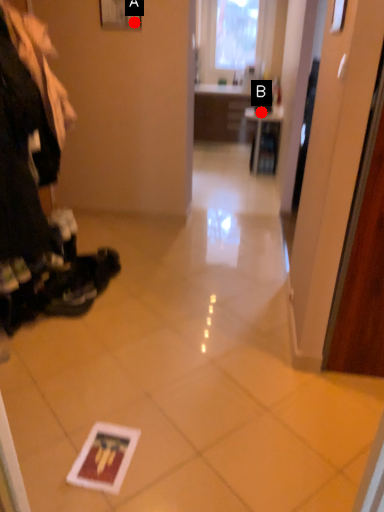
Question: Two points are circled on the image, labeled by A and B beside each circle. Which point is closer to the camera?

Choices:
 (A) A is closer
 (B) B is closer

Answer: (A)